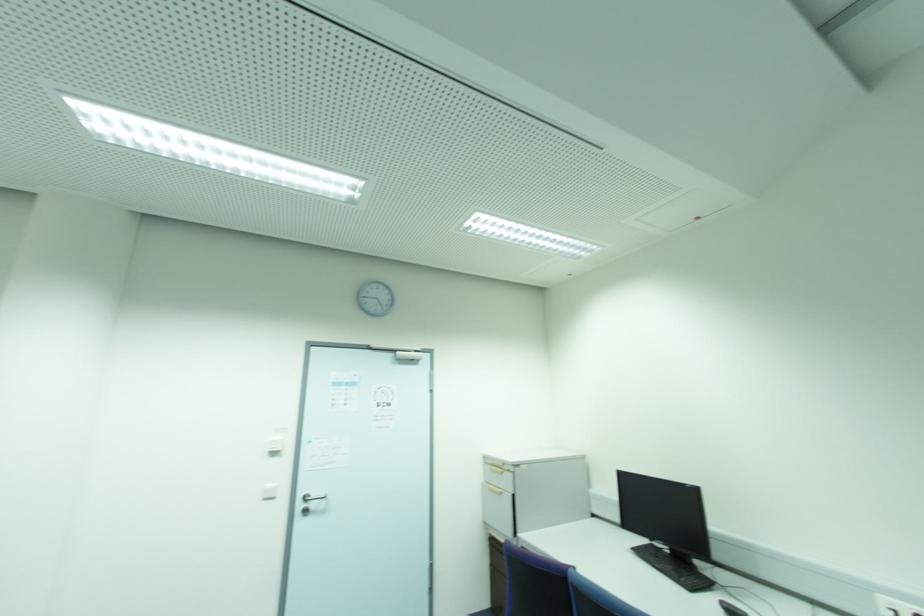
Find where to push the black computer mouse. Please return your answer as a coordinate pair (x, y).

(731, 609)